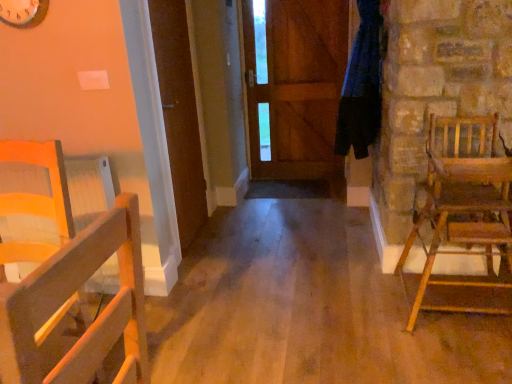
In order to click on free region on the left part of wooden rocking chair at right, acting as the 2th chair starting from the left in this screenshot , I will do `click(364, 313)`.